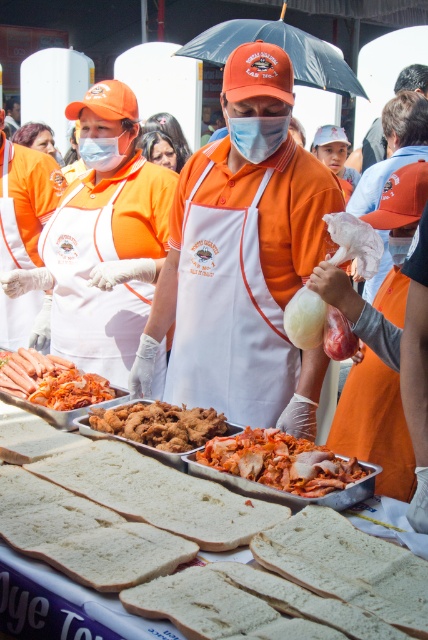
Question: Can you confirm if spicy red meat at center is bigger than matte white mask at left?

Choices:
 (A) no
 (B) yes

Answer: (B)

Question: Is fried golden-brown chicken at center to the left of bright orange sausages at center left from the viewer's perspective?

Choices:
 (A) no
 (B) yes

Answer: (A)

Question: Based on their relative distances, which object is farther from the matte blue fabric mask at center?

Choices:
 (A) orange matte apron at center
 (B) bright orange sausages at center left
 (C) fried golden-brown chicken at center
 (D) spicy red meat at center

Answer: (D)

Question: Which object is positioned closest to the spicy red meat at center?

Choices:
 (A) bright orange sausages at center left
 (B) fried golden-brown chicken at center
 (C) matte white mask at left
 (D) orange matte apron at center

Answer: (B)

Question: Is orange matte apron at center further to the viewer compared to bright orange sausages at center left?

Choices:
 (A) no
 (B) yes

Answer: (A)

Question: Based on their relative distances, which object is farther from the matte blue fabric mask at center?

Choices:
 (A) matte white mask at left
 (B) bright orange sausages at center left
 (C) spicy red meat at center

Answer: (C)